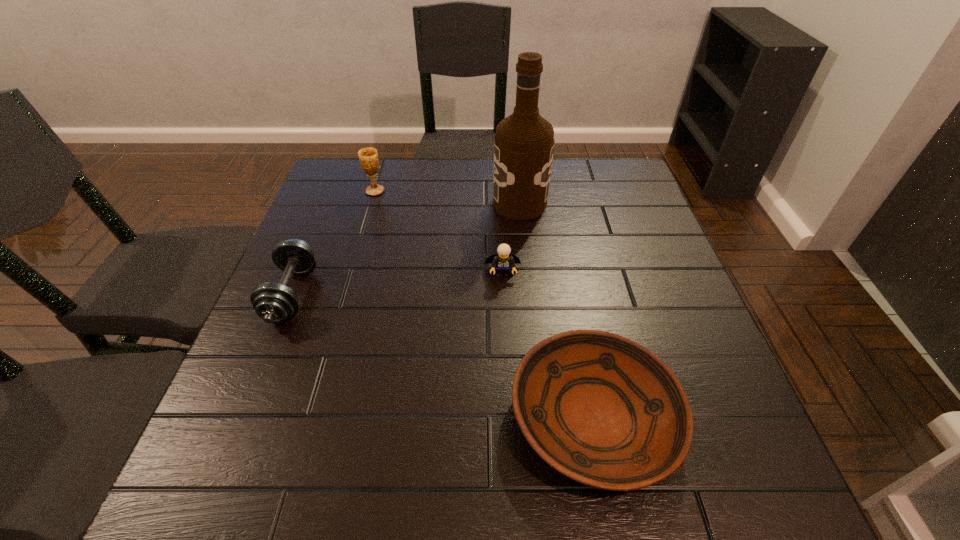
Find the location of a particular element. vacant area situated 0.120m on the back of the fourth object from right to left is located at coordinates (383, 164).

Where is `free point located 0.060m on the back of the dumbbell`? Image resolution: width=960 pixels, height=540 pixels. free point located 0.060m on the back of the dumbbell is located at coordinates click(x=314, y=242).

The height and width of the screenshot is (540, 960). I want to click on vacant space situated on the front-facing side of the Lego, so click(x=512, y=443).

This screenshot has width=960, height=540. Find the location of `free location located 0.290m on the back of the plate`. free location located 0.290m on the back of the plate is located at coordinates (562, 251).

You are a GUI agent. You are given a task and a screenshot of the screen. Output one action in this format:
    pyautogui.click(x=<x>, y=<y>)
    Task: Click on the alcohol that is at the far edge
    This screenshot has width=960, height=540.
    Given the screenshot: What is the action you would take?
    pyautogui.click(x=524, y=142)

The height and width of the screenshot is (540, 960). In order to click on chalice that is positioned at the far edge in this screenshot , I will do `click(368, 157)`.

The image size is (960, 540). I want to click on object present at the near edge, so click(x=604, y=411).

This screenshot has height=540, width=960. Find the location of `chalice at the left edge`. chalice at the left edge is located at coordinates (368, 157).

Image resolution: width=960 pixels, height=540 pixels. What are the coordinates of `dumbbell located at the left edge` in the screenshot? It's located at (273, 302).

Locate an element on the screen. The image size is (960, 540). object present at the right edge is located at coordinates (604, 411).